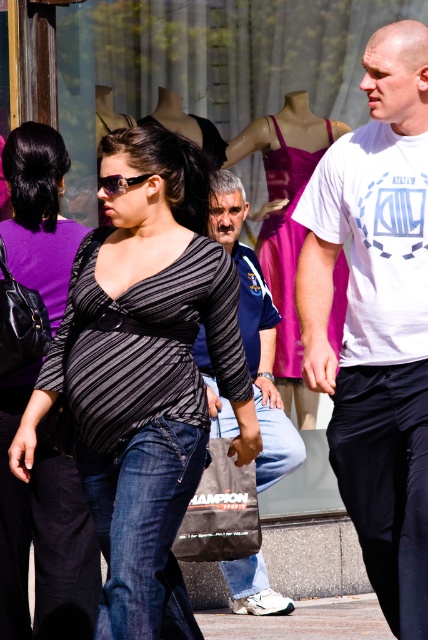
You are a photographer trying to capture a clear shot of both the striped jersey at center and the jeans at center in the busy street scene. Which object should you focus on first to ensure it appears sharp in the photo?

You should focus on the striped jersey at center first because it is closer to the viewer than the jeans at center, ensuring it stays sharp while adjusting focus for the other object.

Based on the scene description, which object takes up more space in the image between the denim jeans at center and the blue cotton shirt at center?

The blue cotton shirt at center takes up more space in the image than the denim jeans at center.